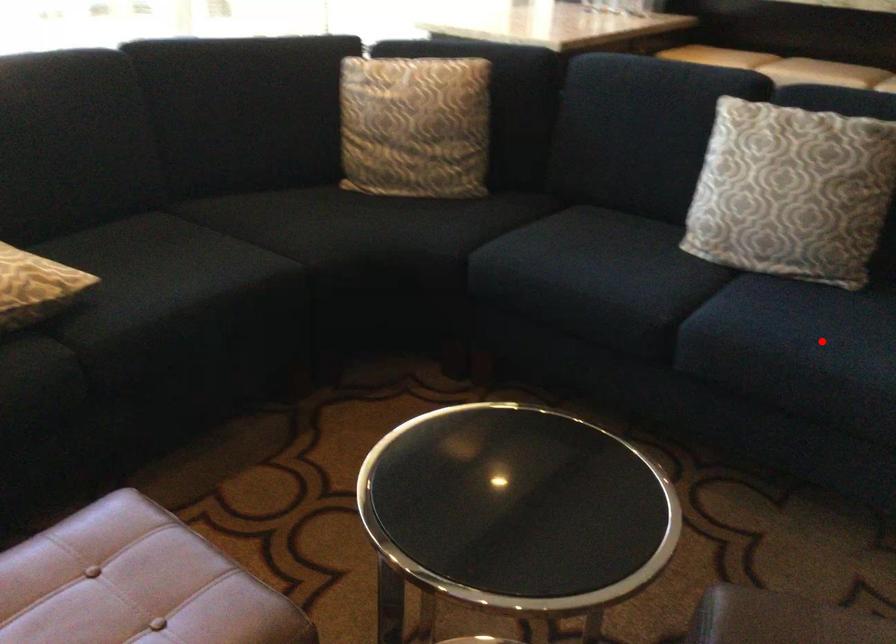
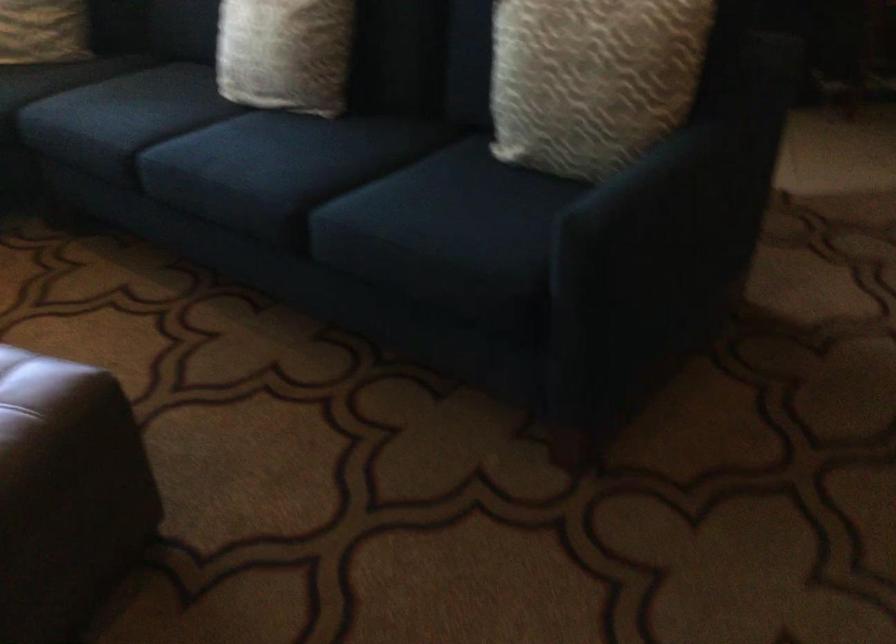
Find the pixel in the second image that matches the highlighted location in the first image.

(245, 154)